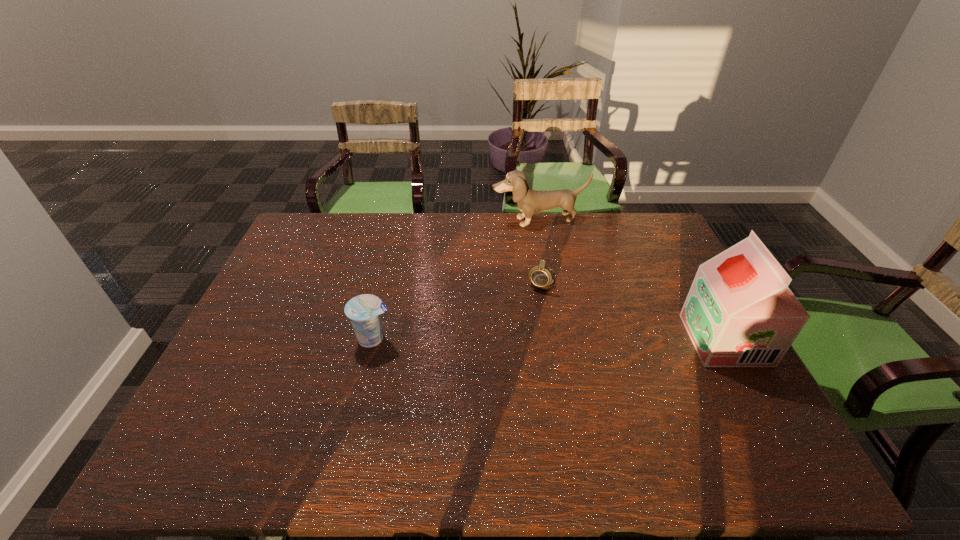
In order to click on the leftmost object in this screenshot , I will do `click(364, 311)`.

Find the location of `the tallest object`. the tallest object is located at coordinates (739, 312).

Where is `the rightmost object`? The image size is (960, 540). the rightmost object is located at coordinates click(x=739, y=312).

Image resolution: width=960 pixels, height=540 pixels. In order to click on the farthest object in this screenshot , I will do `click(529, 201)`.

Where is `the second tallest object`? The image size is (960, 540). the second tallest object is located at coordinates (529, 201).

Image resolution: width=960 pixels, height=540 pixels. What are the coordinates of `compass` in the screenshot? It's located at (541, 277).

Where is `vacant area situated 0.140m on the front of the leftmost object`? vacant area situated 0.140m on the front of the leftmost object is located at coordinates (359, 399).

Find the location of a particular element. free location located 0.050m with the cap open on the rightmost object is located at coordinates (672, 340).

Find the location of a particular element. vacant space located 0.290m with the cap open on the rightmost object is located at coordinates (582, 340).

What are the coordinates of `free space located 0.400m with the cap open on the rightmost object` in the screenshot? It's located at (540, 340).